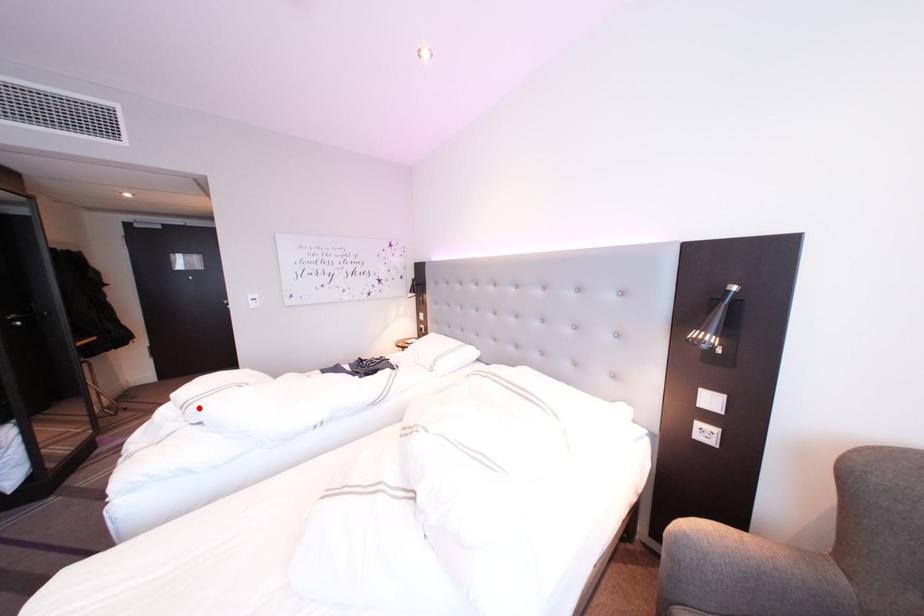
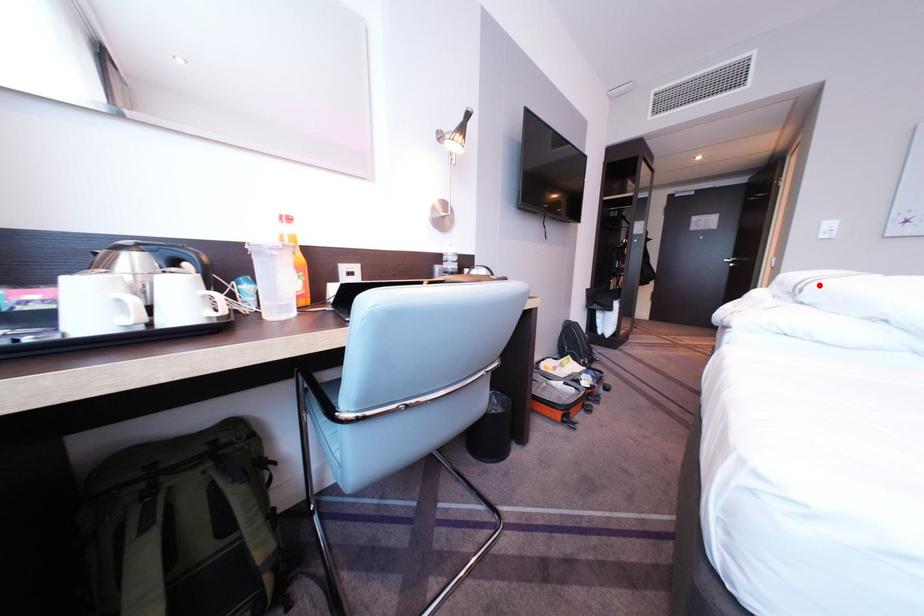
I am providing you with two images of the same scene from different viewpoints. A red point is marked on the first image and another point is marked on the second image. Is the red point in image1 aligned with the point shown in image2?

Yes